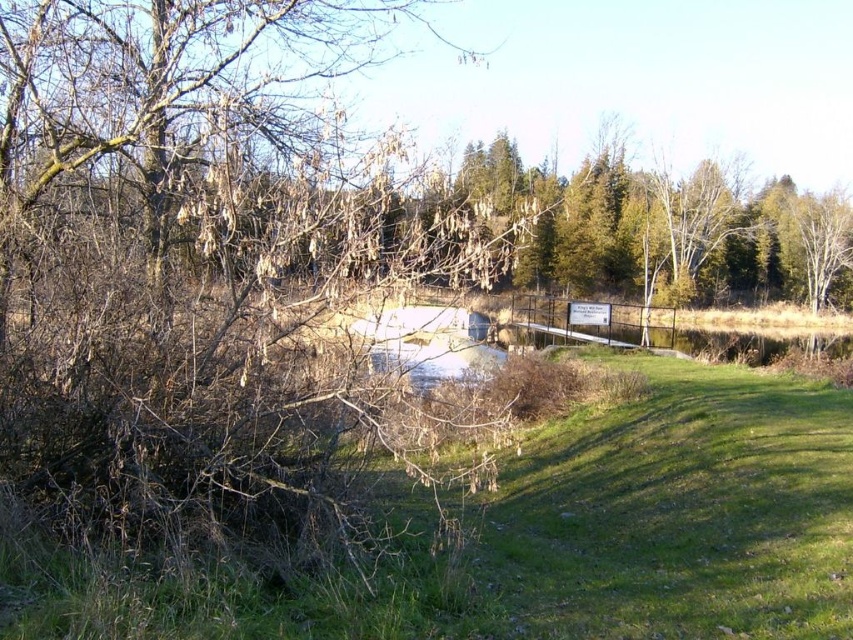
Who is positioned more to the left, brown/dried wood at left or green grass at lower right?

From the viewer's perspective, brown/dried wood at left appears more on the left side.

Describe the element at coordinates (194, 264) in the screenshot. The width and height of the screenshot is (853, 640). I see `brown/dried wood at left` at that location.

Identify the location of brown/dried wood at left. The height and width of the screenshot is (640, 853). (194, 264).

Is green grass at lower right wider than green textured tree at upper center?

Incorrect, green grass at lower right's width does not surpass green textured tree at upper center's.

Is point (422, 604) positioned in front of point (828, 221)?

Yes.

At what (x,y) coordinates should I click in order to perform the action: click on green grass at lower right. Please return your answer as a coordinate pair (x, y). This screenshot has height=640, width=853. Looking at the image, I should click on (573, 534).

Does brown/dried wood at left appear over green textured tree at upper center?

Actually, brown/dried wood at left is below green textured tree at upper center.

Does point (184, 198) come farther from viewer compared to point (566, 204)?

No, (184, 198) is closer to viewer.

The image size is (853, 640). What are the coordinates of `brown/dried wood at left` in the screenshot? It's located at (194, 264).